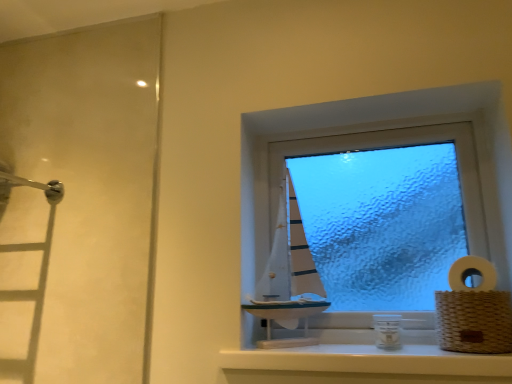
Question: Is white glossy window sill at center positioned far away from woven brown basket at right?

Choices:
 (A) yes
 (B) no

Answer: (B)

Question: Is woven brown basket at right completely or partially inside white glossy window sill at center?

Choices:
 (A) no
 (B) yes

Answer: (A)

Question: Is white glossy window sill at center not within woven brown basket at right?

Choices:
 (A) yes
 (B) no

Answer: (A)

Question: Considering the relative sizes of white glossy window sill at center and woven brown basket at right in the image provided, is white glossy window sill at center wider than woven brown basket at right?

Choices:
 (A) no
 (B) yes

Answer: (B)

Question: Is white glossy window sill at center turned away from woven brown basket at right?

Choices:
 (A) yes
 (B) no

Answer: (B)

Question: From a real-world perspective, is white woven basket at right physically located above or below woven brown basket at right?

Choices:
 (A) above
 (B) below

Answer: (A)

Question: Would you say white woven basket at right is to the left or to the right of woven brown basket at right in the picture?

Choices:
 (A) left
 (B) right

Answer: (B)

Question: From the image's perspective, is white woven basket at right positioned above or below woven brown basket at right?

Choices:
 (A) above
 (B) below

Answer: (A)

Question: In the image, is white woven basket at right positioned in front of or behind woven brown basket at right?

Choices:
 (A) behind
 (B) front

Answer: (A)

Question: From the image's perspective, relative to white woven basket at right, is woven brown basket at right above or below?

Choices:
 (A) above
 (B) below

Answer: (B)

Question: Looking at their shapes, would you say woven brown basket at right is wider or thinner than white woven basket at right?

Choices:
 (A) thin
 (B) wide

Answer: (B)

Question: Is woven brown basket at right to the left or to the right of white woven basket at right in the image?

Choices:
 (A) left
 (B) right

Answer: (A)

Question: Is woven brown basket at right situated inside white woven basket at right or outside?

Choices:
 (A) inside
 (B) outside

Answer: (B)

Question: Is white glossy window sill at center bigger or smaller than white woven basket at right?

Choices:
 (A) small
 (B) big

Answer: (B)

Question: Visually, is white glossy window sill at center positioned to the left or to the right of white woven basket at right?

Choices:
 (A) left
 (B) right

Answer: (A)